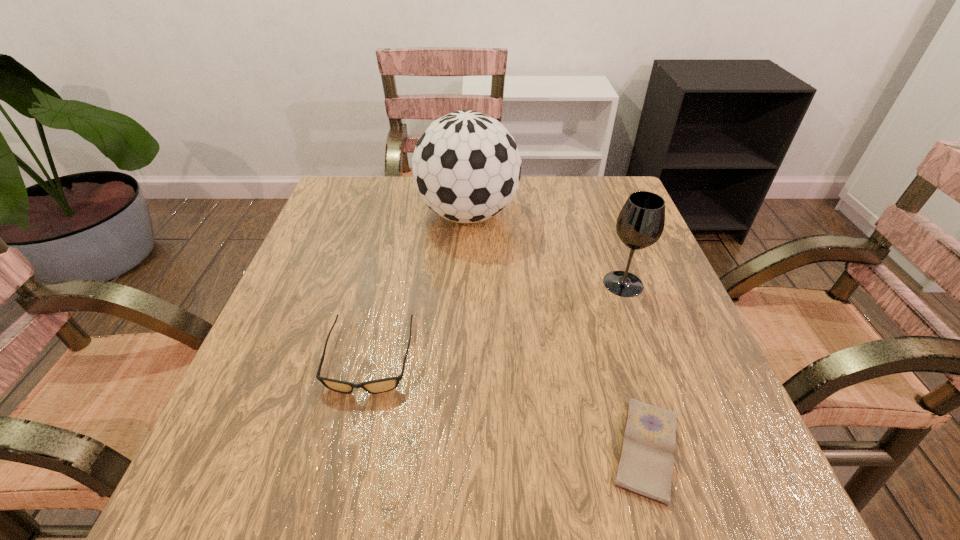
In order to click on vacant space that is in between the sunglasses and the diary in this screenshot , I will do `click(508, 404)`.

Locate an element on the screen. The height and width of the screenshot is (540, 960). vacant space that's between the third shortest object and the diary is located at coordinates (635, 367).

You are a GUI agent. You are given a task and a screenshot of the screen. Output one action in this format:
    pyautogui.click(x=<x>, y=<y>)
    Task: Click on the blank region between the sunglasses and the third shortest object
    
    Given the screenshot: What is the action you would take?
    pyautogui.click(x=496, y=321)

Image resolution: width=960 pixels, height=540 pixels. I want to click on vacant area between the farthest object and the sunglasses, so click(419, 287).

Identify the location of vacant space in between the third tallest object and the third nearest object. This screenshot has width=960, height=540. (496, 321).

Identify which object is the closest to the second farthest object. Please provide its 2D coordinates. Your answer should be formatted as a tuple, i.e. [(x, y)], where the tuple contains the x and y coordinates of a point satisfying the conditions above.

[(466, 166)]

The image size is (960, 540). I want to click on object that ranks as the closest to the tallest object, so click(x=640, y=223).

Image resolution: width=960 pixels, height=540 pixels. Identify the location of free spot that satisfies the following two spatial constraints: 1. on the front-facing side of the sunglasses; 2. on the left side of the nearest object. (348, 449).

What are the coordinates of `free space that satisfies the following two spatial constraints: 1. on the front-facing side of the sunglasses; 2. on the left side of the nearest object` in the screenshot? It's located at (348, 449).

This screenshot has height=540, width=960. I want to click on free spot that satisfies the following two spatial constraints: 1. on the front-facing side of the third farthest object; 2. on the left side of the nearest object, so click(x=348, y=449).